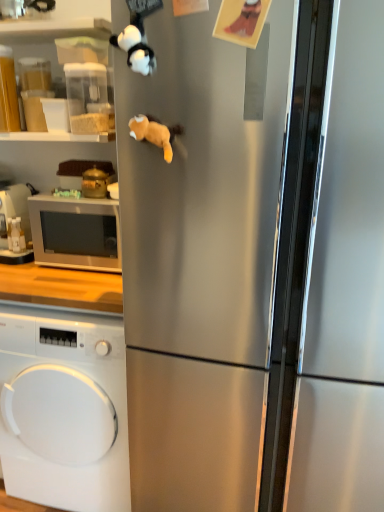
Question: Considering the relative positions of matte black microwave at left, the 1th appliance viewed from the left, and satin silver refrigerator at center in the image provided, is matte black microwave at left, the 1th appliance viewed from the left, in front of satin silver refrigerator at center?

Choices:
 (A) no
 (B) yes

Answer: (A)

Question: Does matte black microwave at left, arranged as the 1th appliance when viewed from the back, appear on the right side of satin silver refrigerator at center?

Choices:
 (A) no
 (B) yes

Answer: (A)

Question: Is matte black microwave at left, placed as the second appliance when sorted from front to back, beside satin silver refrigerator at center?

Choices:
 (A) yes
 (B) no

Answer: (B)

Question: Is matte black microwave at left, placed as the second appliance when sorted from front to back, taller than satin silver refrigerator at center?

Choices:
 (A) no
 (B) yes

Answer: (A)

Question: Can you confirm if matte black microwave at left, arranged as the 1th appliance when viewed from the back, is wider than satin silver refrigerator at center?

Choices:
 (A) yes
 (B) no

Answer: (B)

Question: Is matte black microwave at left, the 1th appliance viewed from the left, facing away from satin silver refrigerator at center?

Choices:
 (A) no
 (B) yes

Answer: (A)

Question: Does satin silver refrigerator at center lie behind gold metallic pot at left, the 2th appliance positioned from the left?

Choices:
 (A) yes
 (B) no

Answer: (B)

Question: Is satin silver refrigerator at center shorter than gold metallic pot at left, the 2th appliance positioned from the left?

Choices:
 (A) no
 (B) yes

Answer: (A)

Question: Does satin silver refrigerator at center come in front of gold metallic pot at left, the 2th appliance in the back-to-front sequence?

Choices:
 (A) yes
 (B) no

Answer: (A)

Question: Can you confirm if satin silver refrigerator at center is bigger than gold metallic pot at left, the 2th appliance in the back-to-front sequence?

Choices:
 (A) yes
 (B) no

Answer: (A)

Question: Is satin silver refrigerator at center not inside gold metallic pot at left, the 2th appliance positioned from the left?

Choices:
 (A) yes
 (B) no

Answer: (A)

Question: Is satin silver refrigerator at center positioned with its back to gold metallic pot at left, the 1th appliance in the right-to-left sequence?

Choices:
 (A) yes
 (B) no

Answer: (B)

Question: Is white glossy microwave at left completely or partially inside gold metallic pot at left, the 2th appliance positioned from the left?

Choices:
 (A) yes
 (B) no

Answer: (B)